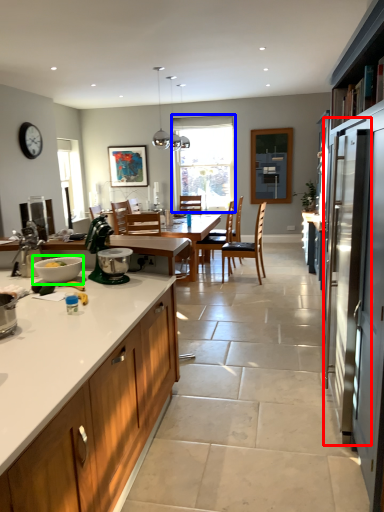
Question: Considering the real-world distances, which object is closest to screen door (highlighted by a red box)? window (highlighted by a blue box) or mixing bowl (highlighted by a green box).

Choices:
 (A) window
 (B) mixing bowl

Answer: (B)